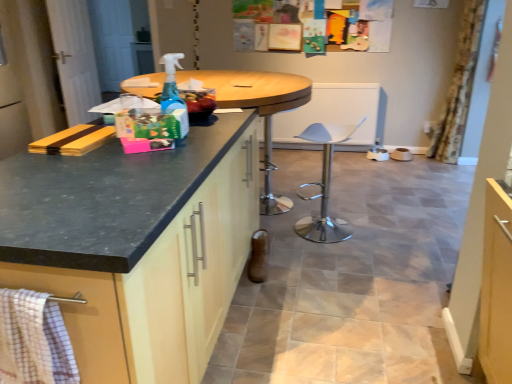
Find the location of a particular element. The image size is (512, 384). vacant area that lies to the right of white plastic swivel chair at center is located at coordinates (376, 233).